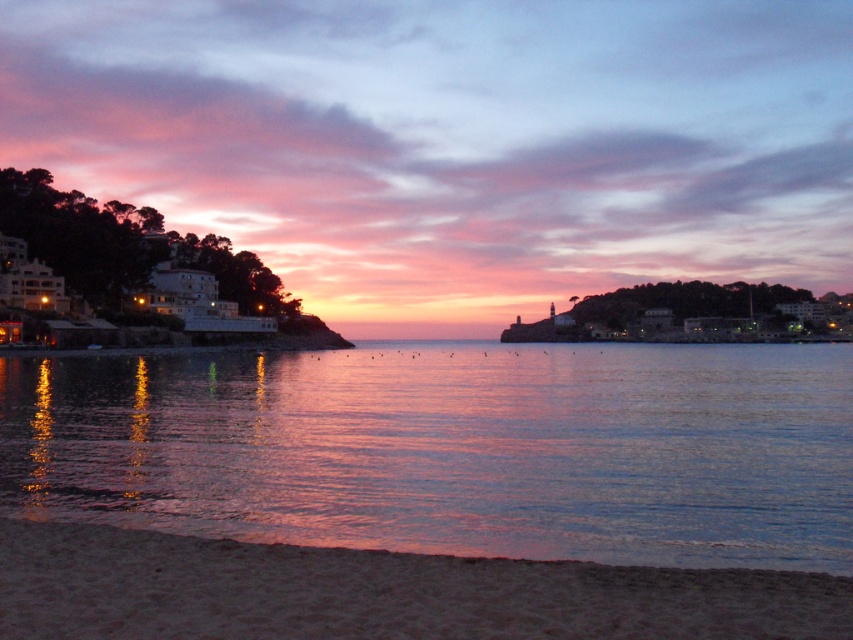
Is point (833, 380) positioned behind point (828, 627)?

Yes, point (833, 380) is behind point (828, 627).

Does shiny reflective water at lower center appear under sandy beach at lower left?

Yes.

Who is more forward, (x=694, y=436) or (x=701, y=624)?

Positioned in front is point (x=701, y=624).

This screenshot has height=640, width=853. Identify the location of shiny reflective water at lower center. coord(451,449).